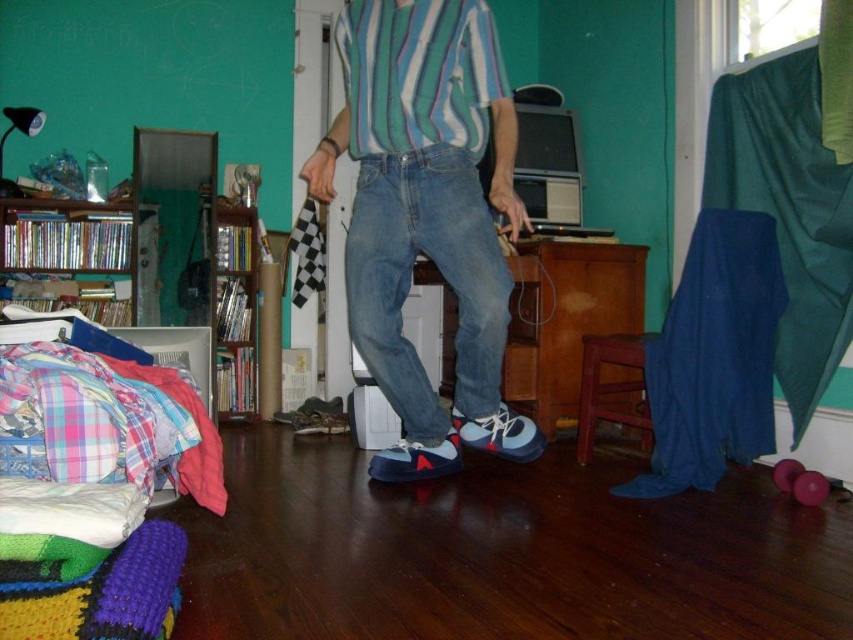
You are standing in the room and want to place a new poster on the wall between the matte blue sneakers at center and the wooden bookshelf at left. Based on their positions, which object is closer to you where you should start measuring from?

The matte blue sneakers at center is closer to the viewer than the wooden bookshelf at left, so you should start measuring from the matte blue sneakers at center.

You are standing in the room and want to place a small plant between the two points, point [364,307] and point [242,346]. Which point should you place it closer to if you want the plant to be closer to you?

You should place the plant closer to point [364,307] because it is closer to the viewer than point [242,346].